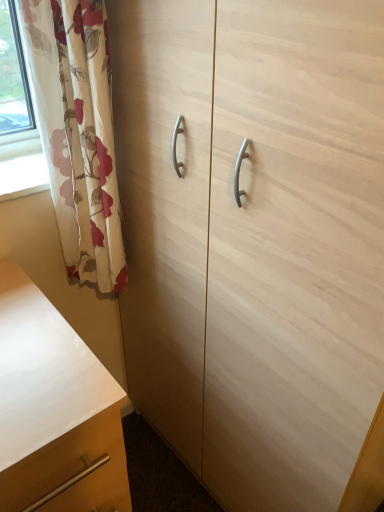
Where is `matte wood chest of drawers at lower left`? The width and height of the screenshot is (384, 512). matte wood chest of drawers at lower left is located at coordinates (55, 410).

Is point (32, 494) positioned before point (72, 209)?

That is True.

Considering the sizes of objects matte wood chest of drawers at lower left and floral fabric curtain at left in the image provided, who is smaller, matte wood chest of drawers at lower left or floral fabric curtain at left?

floral fabric curtain at left is smaller.

In the scene shown: Would you say matte wood chest of drawers at lower left is outside floral fabric curtain at left?

Yes.

From a real-world perspective, is floral fabric curtain at left over matte wood chest of drawers at lower left?

Yes, from a real-world perspective, floral fabric curtain at left is over matte wood chest of drawers at lower left

Is floral fabric curtain at left oriented towards matte wood chest of drawers at lower left?

No, floral fabric curtain at left is not aimed at matte wood chest of drawers at lower left.

Considering the positions of objects floral fabric curtain at left and matte wood chest of drawers at lower left in the image provided, who is more to the right, floral fabric curtain at left or matte wood chest of drawers at lower left?

floral fabric curtain at left.

Consider the image. Between floral fabric curtain at left and matte wood chest of drawers at lower left, which one has smaller size?

With smaller size is floral fabric curtain at left.

Considering the relative sizes of light wood cabinet at center and floral fabric curtain at left in the image provided, is light wood cabinet at center smaller than floral fabric curtain at left?

No, light wood cabinet at center is not smaller than floral fabric curtain at left.

Does light wood cabinet at center have a greater height compared to floral fabric curtain at left?

Correct, light wood cabinet at center is much taller as floral fabric curtain at left.

Is light wood cabinet at center inside the boundaries of floral fabric curtain at left, or outside?

light wood cabinet at center exists outside the volume of floral fabric curtain at left.

From the image's perspective, is light wood cabinet at center on top of floral fabric curtain at left?

No, from the image's perspective, light wood cabinet at center is not on top of floral fabric curtain at left.

Could you tell me if floral fabric curtain at left is facing light wood cabinet at center?

No, floral fabric curtain at left is not oriented towards light wood cabinet at center.

Can you confirm if floral fabric curtain at left is thinner than light wood cabinet at center?

Indeed, floral fabric curtain at left has a lesser width compared to light wood cabinet at center.

In the scene shown: Can light wood cabinet at center be found inside floral fabric curtain at left?

No.

From the image's perspective, is floral fabric curtain at left positioned above or below light wood cabinet at center?

floral fabric curtain at left is situated higher than light wood cabinet at center in the image.

Is matte wood chest of drawers at lower left completely or partially outside of light wood cabinet at center?

That's correct, matte wood chest of drawers at lower left is outside of light wood cabinet at center.

Is matte wood chest of drawers at lower left closer to camera compared to light wood cabinet at center?

No, matte wood chest of drawers at lower left is behind light wood cabinet at center.

From the picture: Considering the relative sizes of matte wood chest of drawers at lower left and light wood cabinet at center in the image provided, is matte wood chest of drawers at lower left bigger than light wood cabinet at center?

Actually, matte wood chest of drawers at lower left might be smaller than light wood cabinet at center.

Looking at this image, considering the sizes of objects light wood cabinet at center and matte wood chest of drawers at lower left in the image provided, who is bigger, light wood cabinet at center or matte wood chest of drawers at lower left?

With larger size is light wood cabinet at center.

Between light wood cabinet at center and matte wood chest of drawers at lower left, which one has more height?

Standing taller between the two is light wood cabinet at center.

Looking at this image, is light wood cabinet at center positioned beyond the bounds of matte wood chest of drawers at lower left?

light wood cabinet at center is positioned outside matte wood chest of drawers at lower left.

Where is `curtain on the right side of matte wood chest of drawers at lower left`? This screenshot has height=512, width=384. curtain on the right side of matte wood chest of drawers at lower left is located at coordinates (78, 132).

At what (x,y) coordinates should I click in order to perform the action: click on curtain above the matte wood chest of drawers at lower left (from a real-world perspective). Please return your answer as a coordinate pair (x, y). The image size is (384, 512). Looking at the image, I should click on (78, 132).

Looking at this image, looking at the image, which one is located closer to floral fabric curtain at left, matte wood chest of drawers at lower left or light wood cabinet at center?

Based on the image, light wood cabinet at center appears to be nearer to floral fabric curtain at left.

When comparing their distances from light wood cabinet at center, does floral fabric curtain at left or matte wood chest of drawers at lower left seem closer?

floral fabric curtain at left.

Considering their positions, is matte wood chest of drawers at lower left positioned closer to light wood cabinet at center than floral fabric curtain at left?

Among the two, floral fabric curtain at left is located nearer to light wood cabinet at center.

Looking at the image, which one is located closer to floral fabric curtain at left, light wood cabinet at center or matte wood chest of drawers at lower left?

light wood cabinet at center is positioned closer to the anchor floral fabric curtain at left.

Which object lies nearer to the anchor point matte wood chest of drawers at lower left, floral fabric curtain at left or light wood cabinet at center?

floral fabric curtain at left lies closer to matte wood chest of drawers at lower left than the other object.

From the image, which object appears to be nearer to matte wood chest of drawers at lower left, light wood cabinet at center or floral fabric curtain at left?

Among the two, floral fabric curtain at left is located nearer to matte wood chest of drawers at lower left.

Identify the location of cabinetry between floral fabric curtain at left and matte wood chest of drawers at lower left from top to bottom. (258, 243).